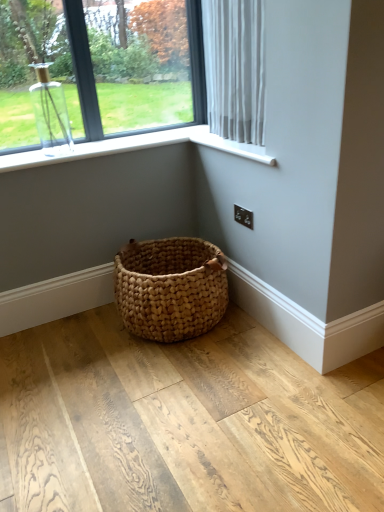
Question: Is clear glass vase at upper left at the back of white plastic window sill at upper right?

Choices:
 (A) no
 (B) yes

Answer: (A)

Question: Does white plastic window sill at upper right have a larger size compared to clear glass vase at upper left?

Choices:
 (A) yes
 (B) no

Answer: (B)

Question: Can you confirm if white plastic window sill at upper right is wider than clear glass vase at upper left?

Choices:
 (A) no
 (B) yes

Answer: (B)

Question: Considering the relative sizes of white plastic window sill at upper right and clear glass vase at upper left in the image provided, is white plastic window sill at upper right taller than clear glass vase at upper left?

Choices:
 (A) no
 (B) yes

Answer: (A)

Question: Is clear glass vase at upper left inside white plastic window sill at upper right?

Choices:
 (A) yes
 (B) no

Answer: (B)

Question: From a real-world perspective, is white plastic window sill at upper right over clear glass vase at upper left?

Choices:
 (A) yes
 (B) no

Answer: (B)

Question: From the image's perspective, is clear glass vase at upper left under white plastic window sill at upper right?

Choices:
 (A) yes
 (B) no

Answer: (B)

Question: Considering the relative positions of clear glass vase at upper left and white plastic window sill at upper right in the image provided, is clear glass vase at upper left in front of white plastic window sill at upper right?

Choices:
 (A) no
 (B) yes

Answer: (A)

Question: From the image's perspective, is clear glass vase at upper left over white plastic window sill at upper right?

Choices:
 (A) yes
 (B) no

Answer: (A)

Question: Does clear glass vase at upper left have a greater height compared to white plastic window sill at upper right?

Choices:
 (A) no
 (B) yes

Answer: (B)

Question: Is clear glass vase at upper left to the right of white plastic window sill at upper right from the viewer's perspective?

Choices:
 (A) yes
 (B) no

Answer: (B)

Question: Is clear glass vase at upper left further to camera compared to white plastic window sill at upper right?

Choices:
 (A) no
 (B) yes

Answer: (B)

Question: From a real-world perspective, is clear glass vase at upper left located higher than white sheer curtain at upper right?

Choices:
 (A) yes
 (B) no

Answer: (A)